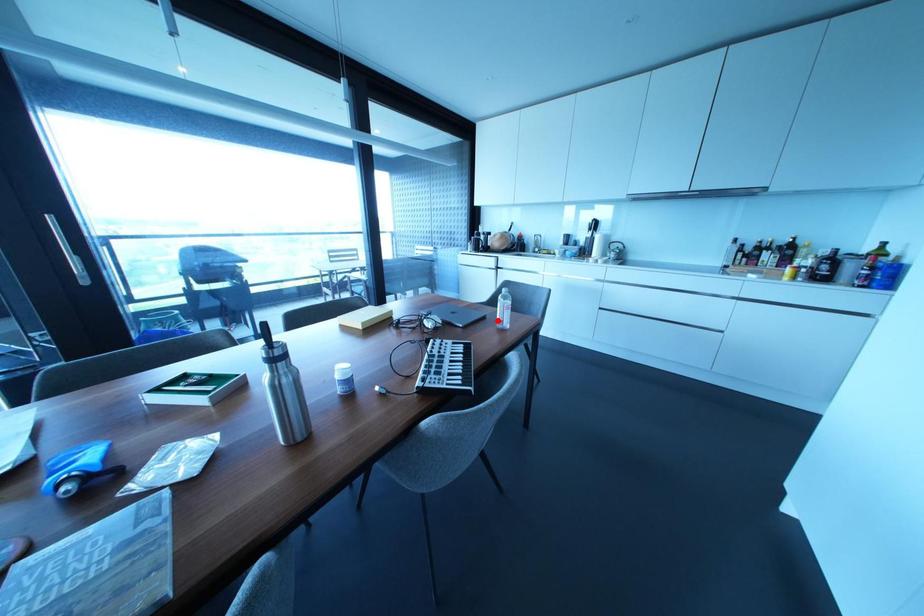
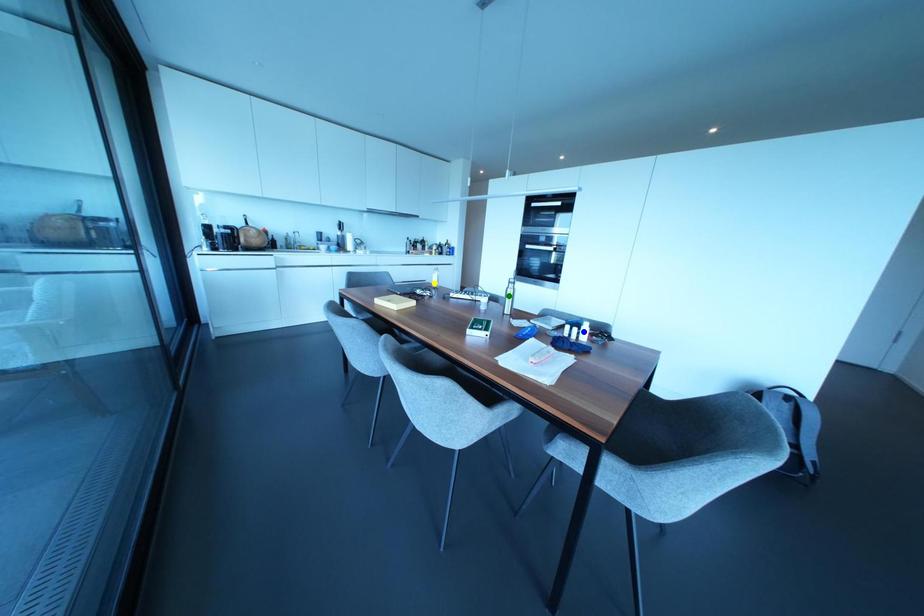
Question: I am providing you with two images of the same scene from different viewpoints. A red point is marked on the first image. You are given multiple points on the second image. Which point in image 2 represents the same 3d spot as the red point in image 1?

Choices:
 (A) yellow point
 (B) green point
 (C) blue point

Answer: (A)